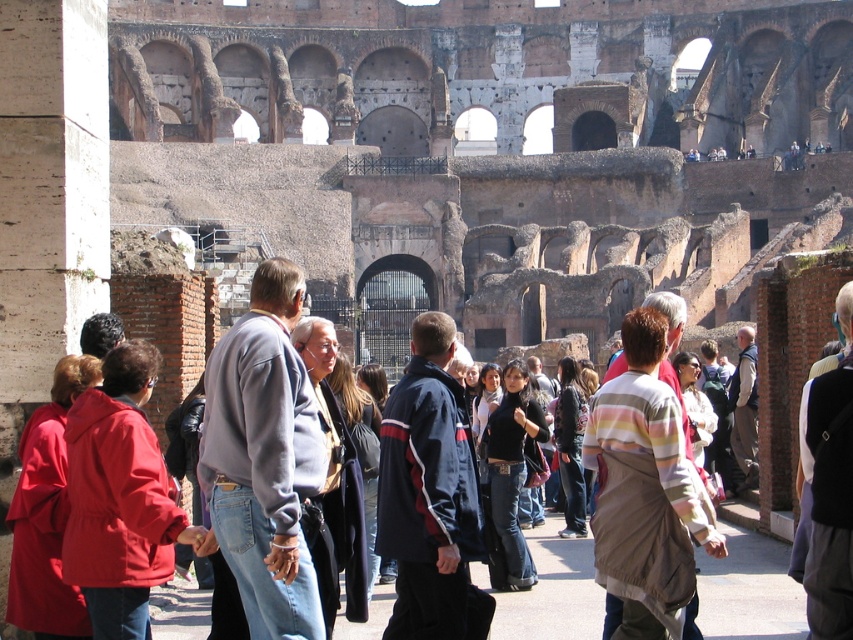
Does striped cotton shirt at center appear on the left side of black leather jacket at center?

Incorrect, striped cotton shirt at center is not on the left side of black leather jacket at center.

Is point (656, 554) positioned behind point (509, 448)?

No, it is in front of (509, 448).

Where is `striped cotton shirt at center`? striped cotton shirt at center is located at coordinates (645, 488).

Does striped cotton shirt at center have a greater width compared to white cotton shirt at center?

Incorrect, striped cotton shirt at center's width does not surpass white cotton shirt at center's.

Is the position of striped cotton shirt at center more distant than that of white cotton shirt at center?

Yes, striped cotton shirt at center is further from the viewer.

Is point (720, 536) behind point (840, 465)?

Yes.

Where is `striped cotton shirt at center`? The image size is (853, 640). striped cotton shirt at center is located at coordinates (645, 488).

From the picture: Is matte red jacket at lower left taller than matte red coat at lower left?

No, matte red jacket at lower left is not taller than matte red coat at lower left.

Can you confirm if matte red jacket at lower left is smaller than matte red coat at lower left?

Indeed, matte red jacket at lower left has a smaller size compared to matte red coat at lower left.

Is point (115, 465) positioned after point (51, 422)?

No, (115, 465) is closer to viewer.

Find the location of `matte red jacket at lower left`. matte red jacket at lower left is located at coordinates (120, 497).